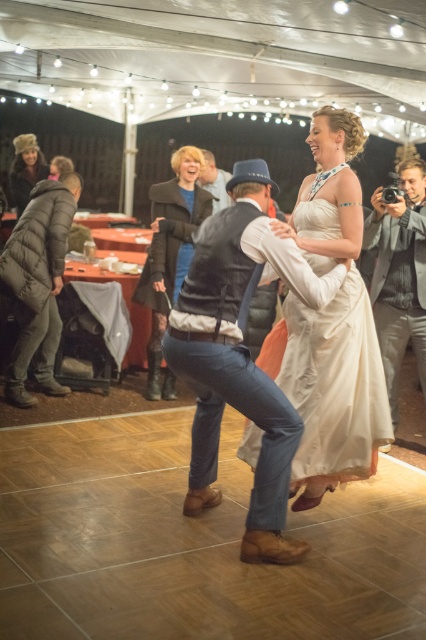
You are a photographer at the wedding reception. You need to capture a photo that includes both the dark gray puffer jacket at left and the fuzzy brown hat at upper left. Which object should you adjust your camera angle to focus on first to ensure both are in frame?

The dark gray puffer jacket at left is smaller than the fuzzy brown hat at upper left, so you should focus on the smaller object first to ensure both fit within the frame.